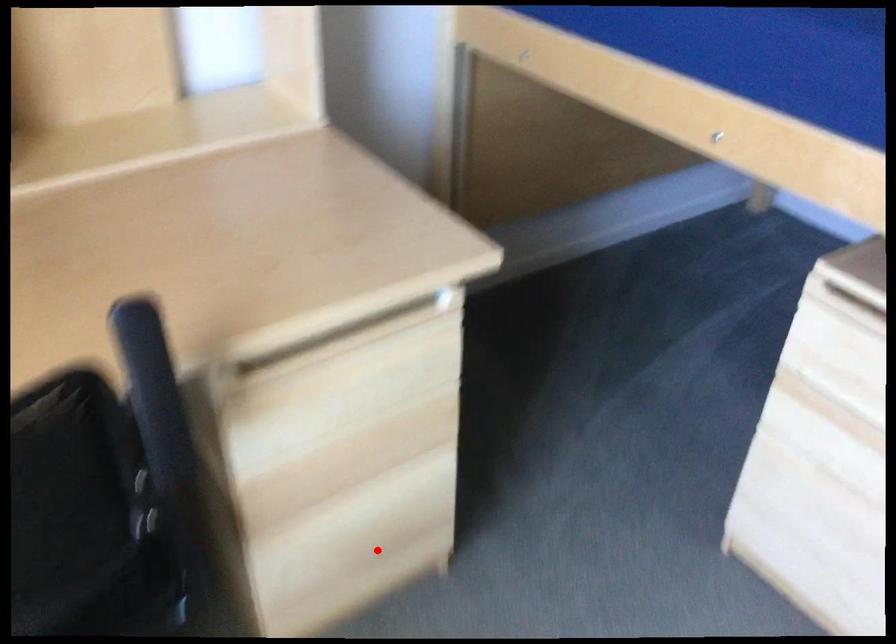
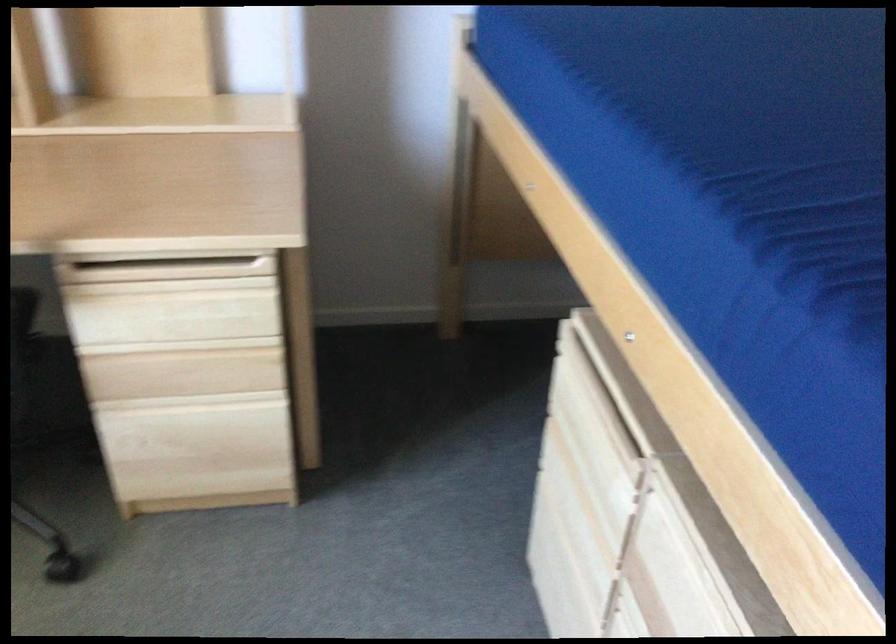
Locate, in the second image, the point that corresponds to the highlighted location in the first image.

(202, 460)